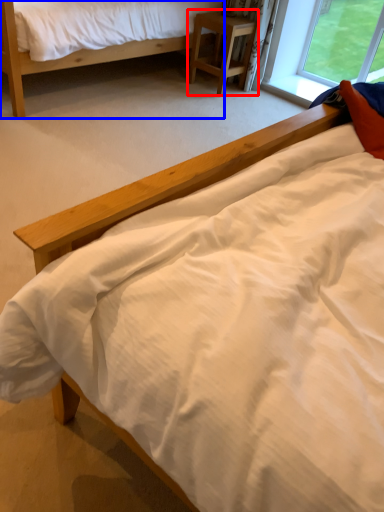
Question: Which object appears closest to the camera in this image, nightstand (highlighted by a red box) or bed (highlighted by a blue box)?

Choices:
 (A) nightstand
 (B) bed

Answer: (B)